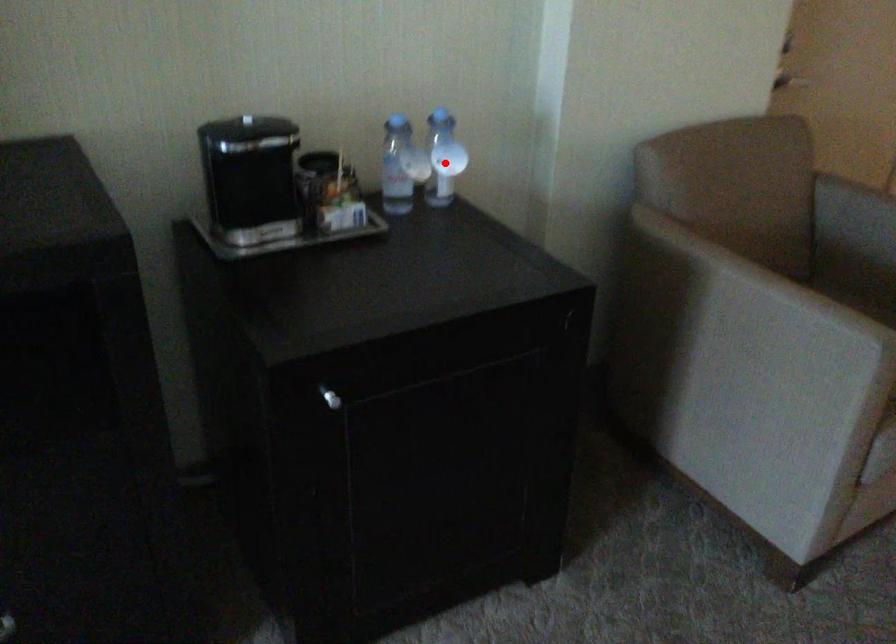
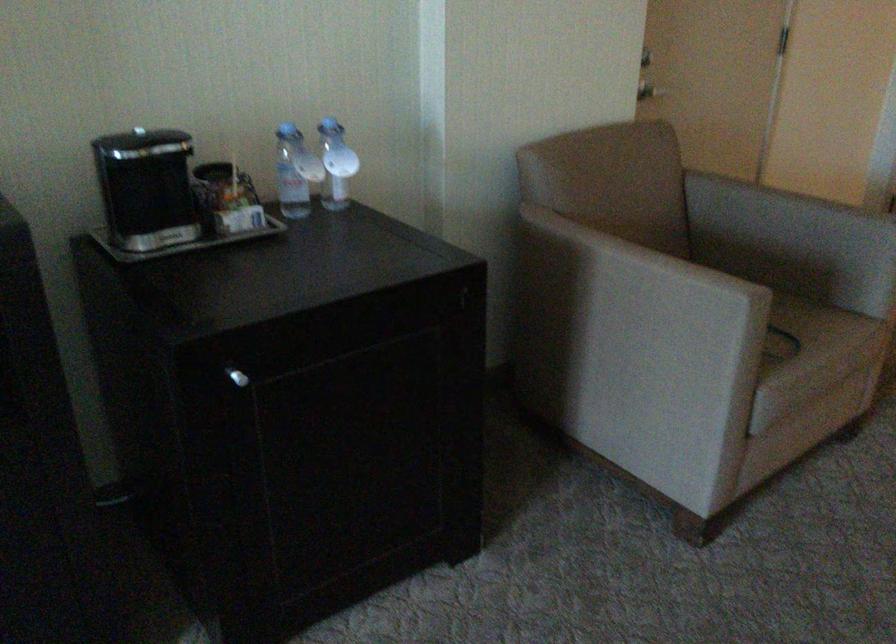
Locate, in the second image, the point that corresponds to the highlighted location in the first image.

(336, 164)